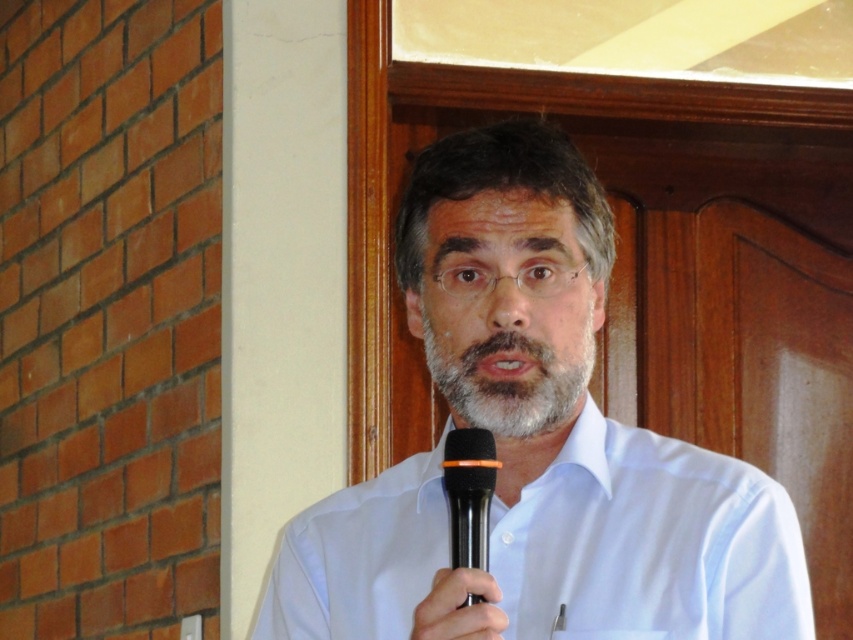
You are an event organizer preparing for a presentation. You have two shirts available for the speaker to wear. The white matte shirt at center and the white smooth shirt at center. The speaker wants to choose the shirt that will be more visually noticeable from a distance. Which shirt should they choose based on their material properties?

The white matte shirt at center has a greater width than the white smooth shirt at center, making it more visually noticeable from a distance due to its larger size.

You are an event organizer preparing for a presentation. You have two shirts to choose from displayed in the image. The white matte shirt at center and the white smooth shirt at center. Which shirt is bigger in size?

The white matte shirt at center is larger in size compared to the white smooth shirt at center.

In the scene shown: You are an event organizer who needs to ensure the microphone is visible to the audience. Given the white smooth shirt at center and the matte black microphone at center, which object is bigger and might block the microphone from view?

The white smooth shirt at center is larger in size than the matte black microphone at center, so it might block the microphone from view.